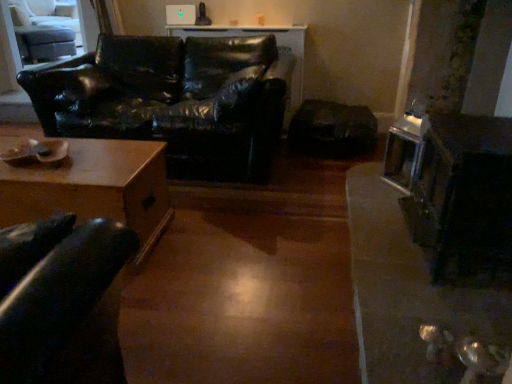
Locate an element on the screen. Image resolution: width=512 pixels, height=384 pixels. free space to the right of wooden table at lower left is located at coordinates (214, 250).